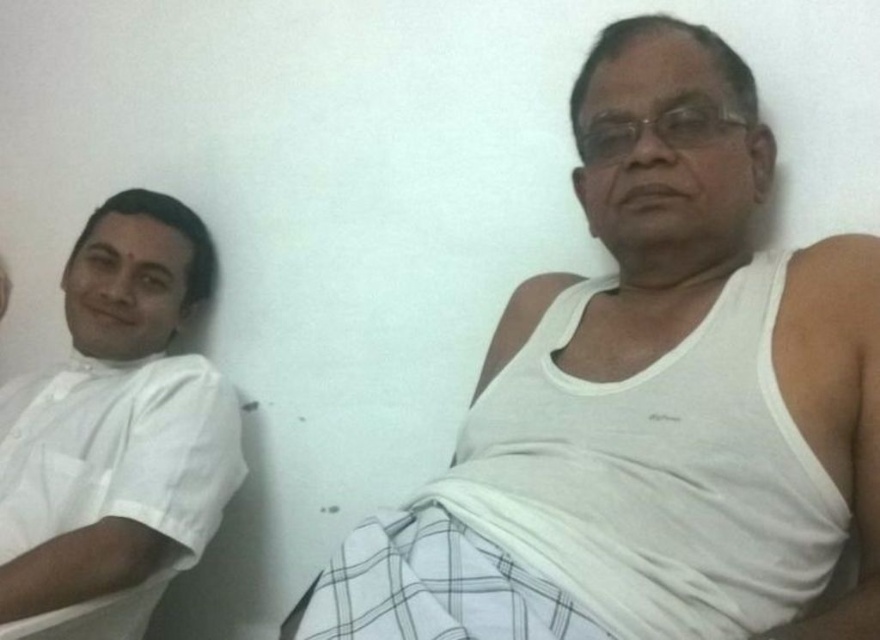
You are organizing a laundry day and need to sort clothes by size. You have a white cotton tank top at center and a white cotton shirt at left. Which one should you place in the large size bin?

The white cotton tank top at center should be placed in the large size bin because it has a larger size compared to the white cotton shirt at left.

In the scene shown: You are standing in front of the image and want to touch the white cotton tank top at center and the white cotton shirt at left. Which one would you need to reach out more to touch?

The white cotton shirt at left is further away from you than the white cotton tank top at center, so you would need to reach out more to touch the white cotton shirt at left.

From the picture: You are organizing a clothing donation drive and need to arrange the items by their position. You have a white cotton tank top at center and a white cotton shirt at left. According to the image, which clothing item is located to the right of the other?

The white cotton tank top at center is positioned on the right side of the white cotton shirt at left, so the tank top is to the right of the shirt.